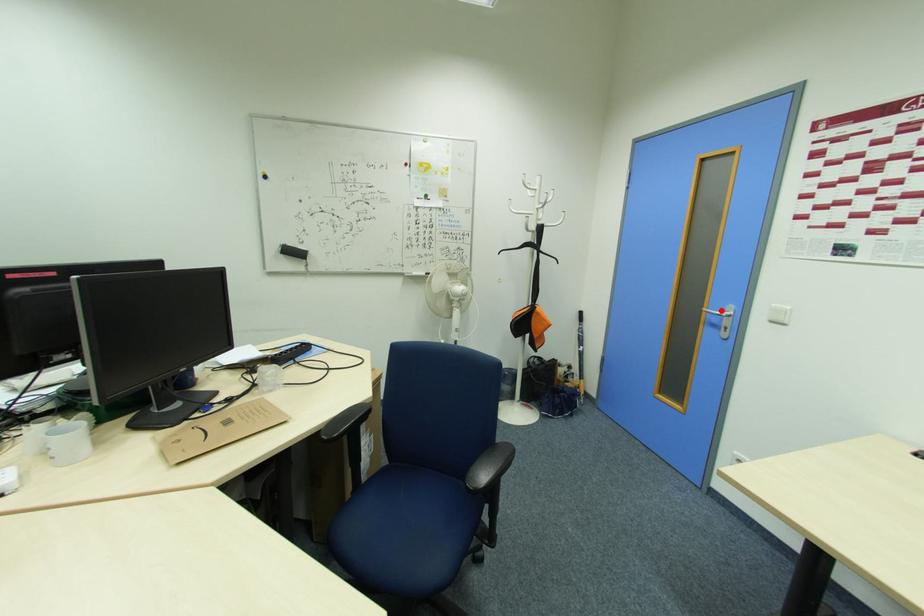
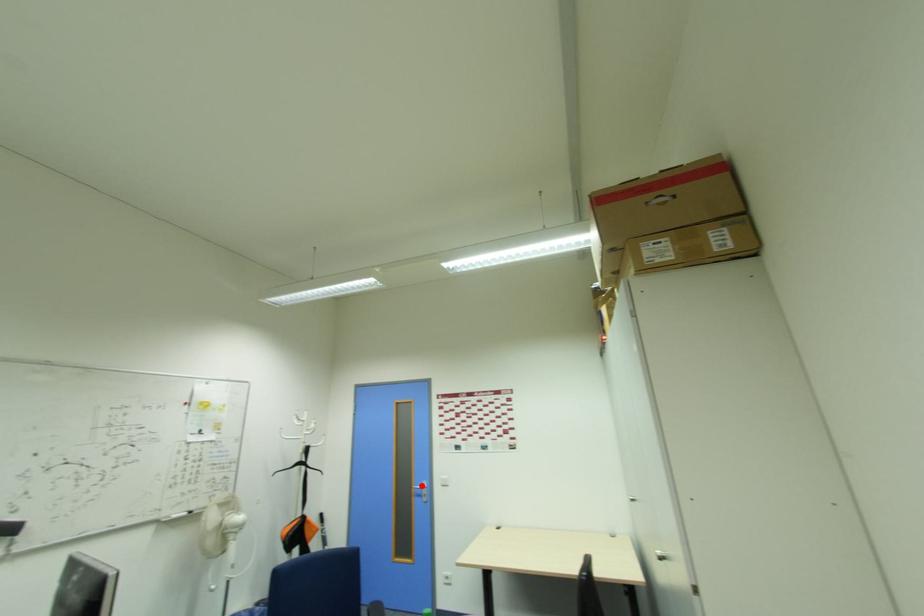
I am providing you with two images of the same scene from different viewpoints. A red point is marked on the first image and another point is marked on the second image. Is the marked point in image1 the same physical position as the marked point in image2?

Yes